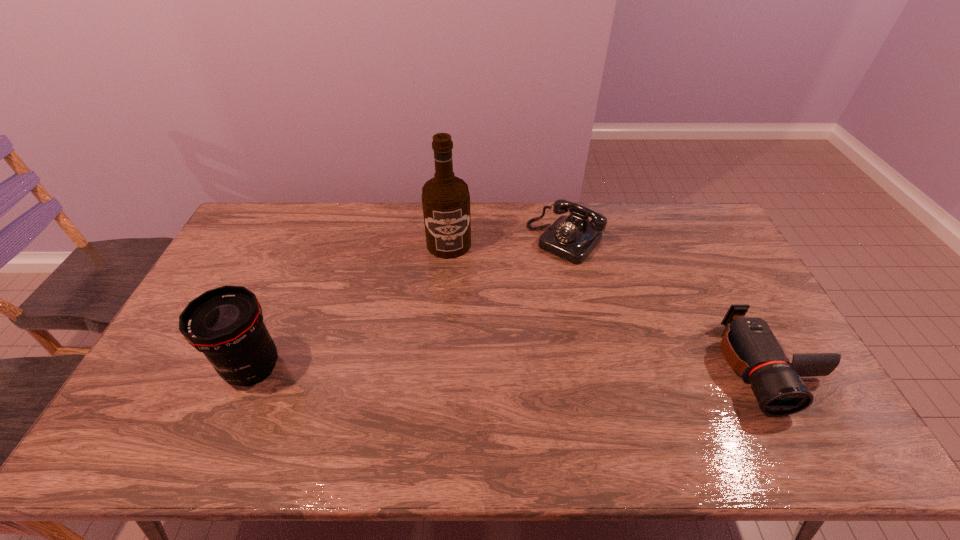
Identify the location of empty space between the telephone and the alcohol. (507, 242).

Image resolution: width=960 pixels, height=540 pixels. In order to click on vacant region between the telephone and the camcorder in this screenshot , I will do `click(666, 304)`.

Where is `blank region between the telephone and the rightmost object`? The width and height of the screenshot is (960, 540). blank region between the telephone and the rightmost object is located at coordinates (666, 304).

Identify the location of vacant area between the telephone and the tallest object. The width and height of the screenshot is (960, 540). (507, 242).

Locate an element on the screen. Image resolution: width=960 pixels, height=540 pixels. vacant space that's between the camcorder and the alcohol is located at coordinates (608, 306).

Locate an element on the screen. This screenshot has width=960, height=540. vacant area that lies between the telephoto lens and the second object from left to right is located at coordinates (351, 306).

At what (x,y) coordinates should I click in order to perform the action: click on empty space that is in between the rightmost object and the telephoto lens. Please return your answer as a coordinate pair (x, y). Looking at the image, I should click on (510, 367).

Locate an element on the screen. object that can be found as the closest to the alcohol is located at coordinates (572, 238).

Where is `object that stands as the closest to the leftmost object`? The height and width of the screenshot is (540, 960). object that stands as the closest to the leftmost object is located at coordinates (445, 198).

The image size is (960, 540). Identify the location of blank space that satisfies the following two spatial constraints: 1. on the back side of the alcohol; 2. on the left side of the second object from right to left. (449, 241).